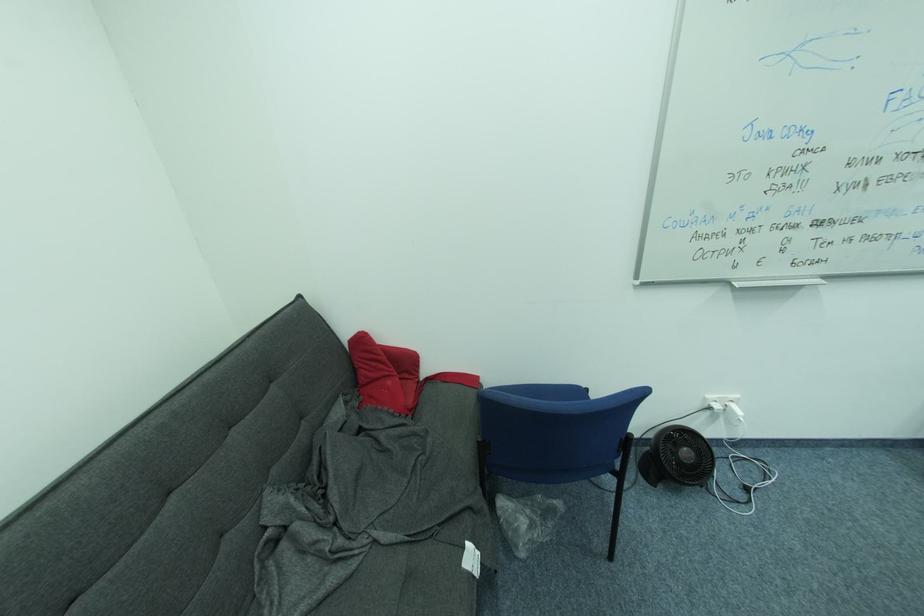
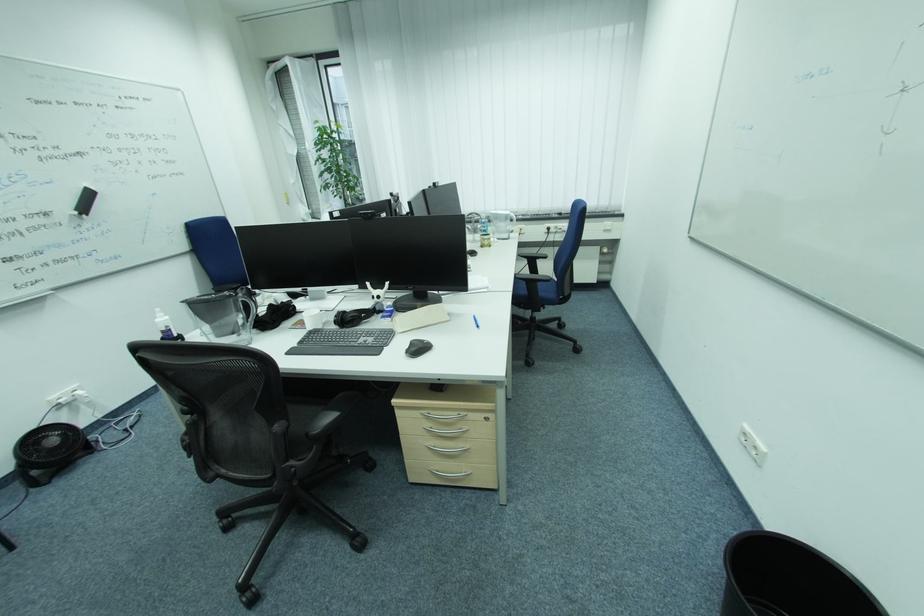
Locate, in the second image, the point that corresponds to the point at 694,455 in the first image.

(59, 442)